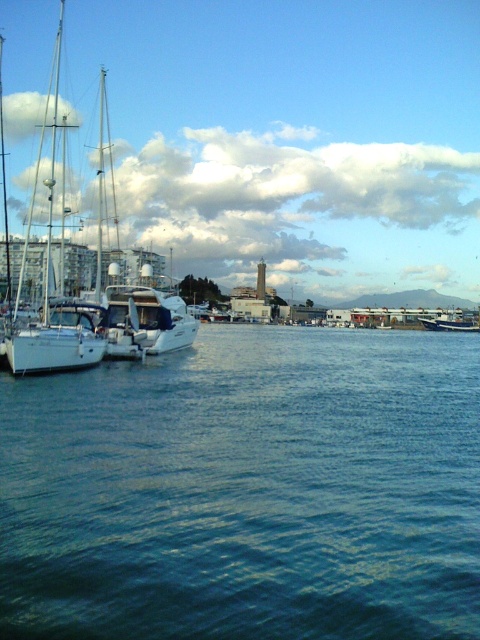
You are a photographer planning to take a photo of the white glossy sailboat at left and the blue glossy boat at right from the shore. Which boat should you focus on first if you want to capture both in a single shot without moving your camera? Explain your reasoning based on their positions.

The white glossy sailboat at left is taller than the blue glossy boat at right. To capture both in a single shot without moving the camera, focus on the taller boat first, which is the white glossy sailboat at left, as it requires adjusting the camera angle to include its height, ensuring the shorter blue glossy boat at right will naturally fit within the frame.

You are standing on the dock and looking at the blue water at center and the white glossy sailboat at left. Which object appears taller from your perspective?

The white glossy sailboat at left appears taller than the blue water at center because the blue water at center is shorter than the white glossy sailboat at left.

You are a photographer planning to take a photo of the white glossy sailboat at left and the blue glossy boat at right. Since you want both boats to appear balanced in the frame, which boat should you move closer to the camera to achieve this?

To balance the white glossy sailboat at left and the blue glossy boat at right in the frame, you should move the blue glossy boat at right closer to the camera. Since the white glossy sailboat at left is larger, moving the smaller blue glossy boat at right closer can help create visual balance between their sizes.